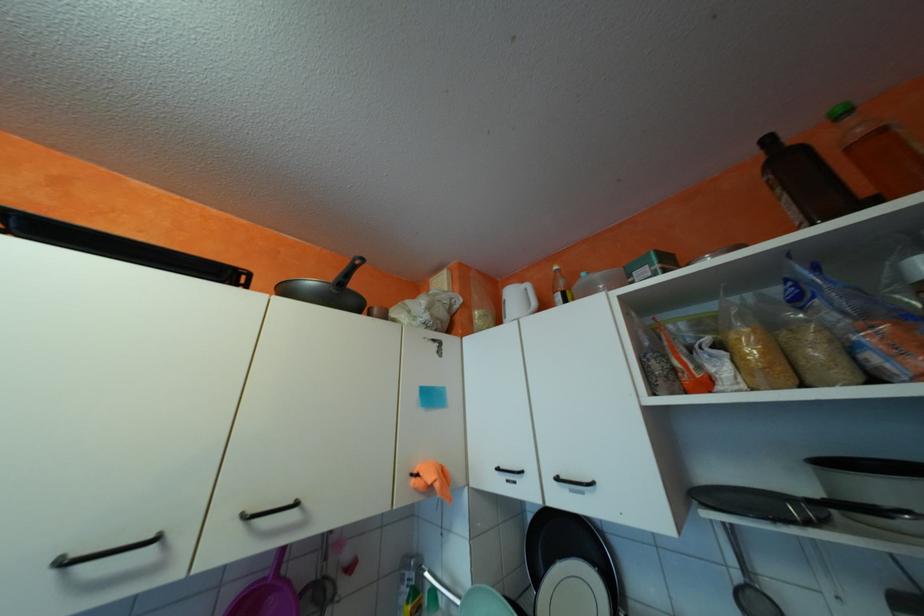
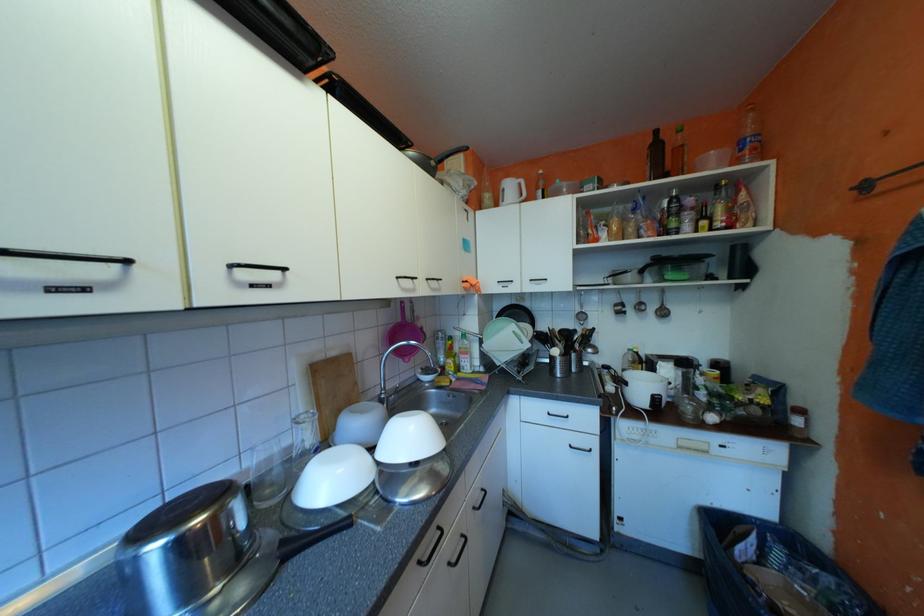
How did the camera likely rotate?

The camera rotated toward right-down.